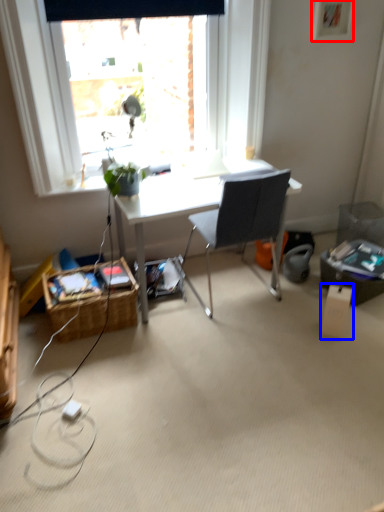
Question: Which object appears farthest to the camera in this image, picture frame (highlighted by a red box) or box (highlighted by a blue box)?

Choices:
 (A) picture frame
 (B) box

Answer: (A)